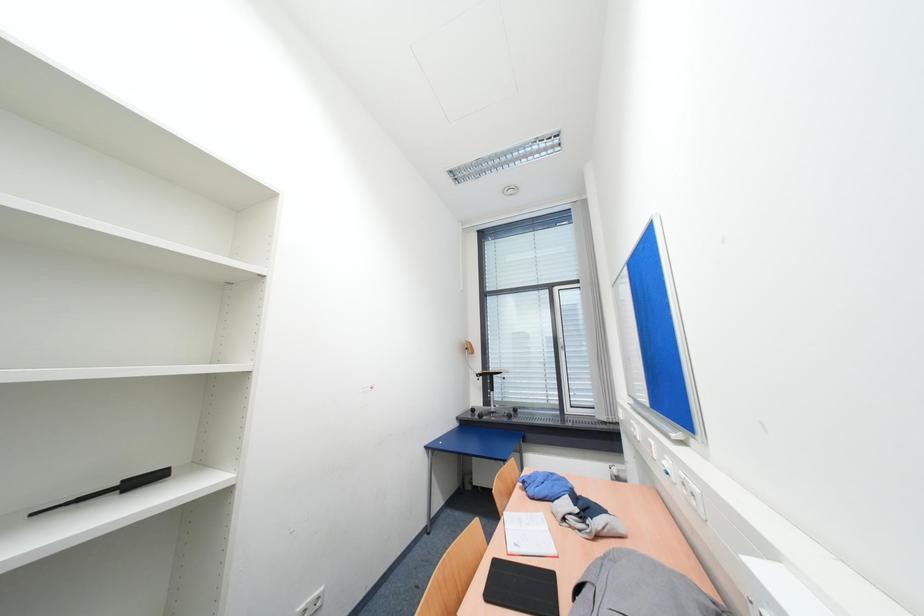
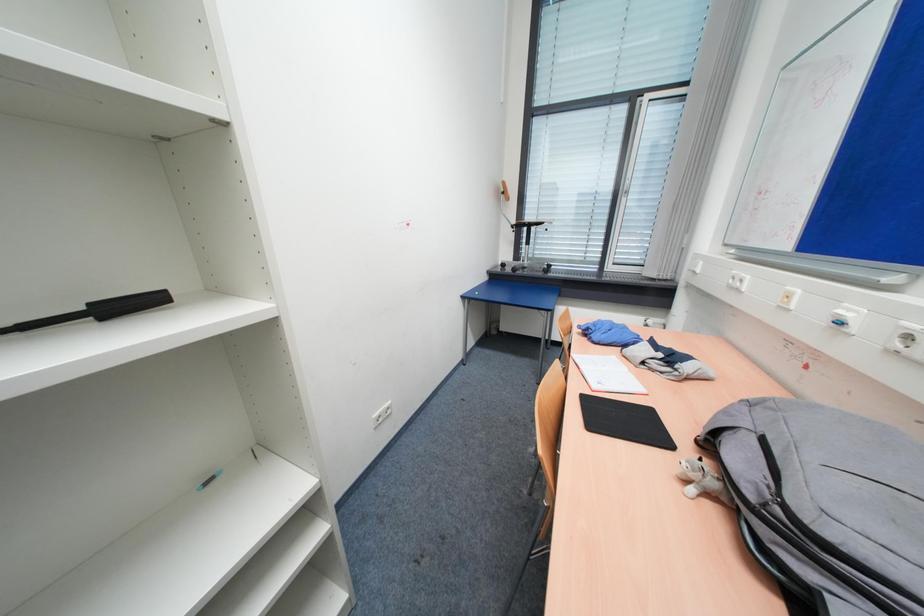
Question: Based on the continuous images, in which direction is the camera rotating? Reply with the corresponding letter.

Choices:
 (A) Left
 (B) Right
 (C) Up
 (D) Down

Answer: (D)